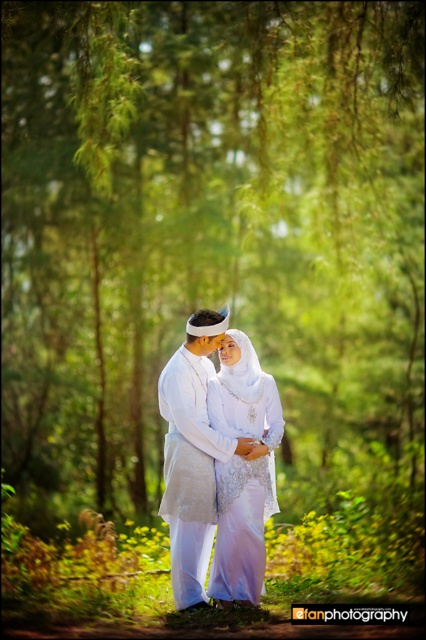
Question: Where is white satin dress at center located in relation to white satin robe at center in the image?

Choices:
 (A) right
 (B) left

Answer: (A)

Question: Is white satin dress at center wider than white satin robe at center?

Choices:
 (A) no
 (B) yes

Answer: (A)

Question: Is white satin dress at center to the left of white satin robe at center from the viewer's perspective?

Choices:
 (A) yes
 (B) no

Answer: (B)

Question: Among these points, which one is nearest to the camera?

Choices:
 (A) (221, 397)
 (B) (180, 451)

Answer: (B)

Question: Which point appears closest to the camera in this image?

Choices:
 (A) (247, 506)
 (B) (199, 394)

Answer: (A)